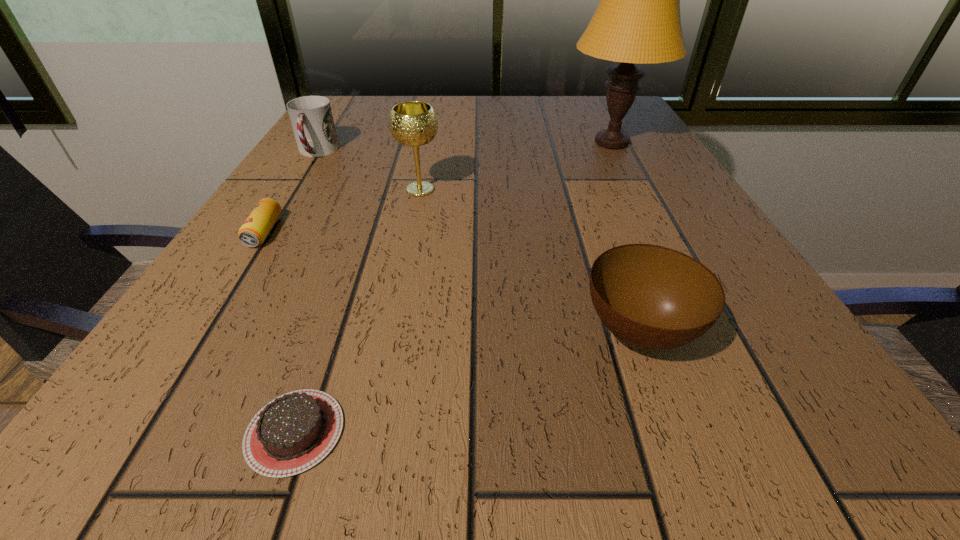
I want to click on the tallest object, so click(637, 20).

At what (x,y) coordinates should I click in order to perform the action: click on chalice. Please return your answer as a coordinate pair (x, y). The height and width of the screenshot is (540, 960). Looking at the image, I should click on (413, 123).

This screenshot has width=960, height=540. What are the coordinates of `the second tallest object` in the screenshot? It's located at (413, 123).

You are a GUI agent. You are given a task and a screenshot of the screen. Output one action in this format:
    pyautogui.click(x=<x>, y=<y>)
    Task: Click on the cup
    This screenshot has width=960, height=540.
    Given the screenshot: What is the action you would take?
    pyautogui.click(x=311, y=117)

This screenshot has height=540, width=960. In order to click on the third shortest object in this screenshot , I will do `click(652, 297)`.

Where is `the fifth farthest object`? the fifth farthest object is located at coordinates (652, 297).

The width and height of the screenshot is (960, 540). Find the location of `beer can`. beer can is located at coordinates (255, 229).

The image size is (960, 540). In order to click on the third nearest object in this screenshot , I will do `click(255, 229)`.

This screenshot has height=540, width=960. I want to click on chocolate cake, so click(x=295, y=431).

At what (x,y) coordinates should I click in order to perform the action: click on the shortest object. Please return your answer as a coordinate pair (x, y). Image resolution: width=960 pixels, height=540 pixels. Looking at the image, I should click on (295, 431).